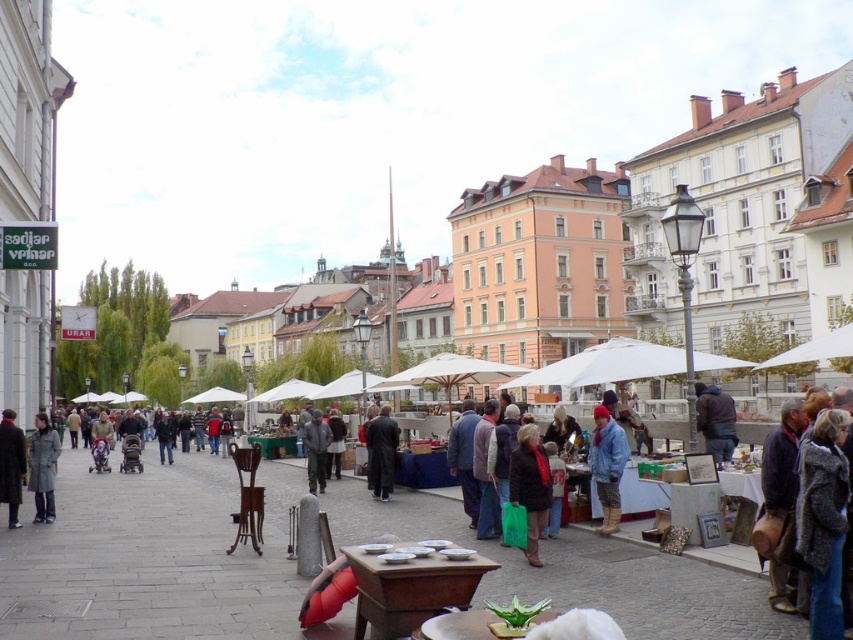
Question: Which point is farther to the camera?

Choices:
 (A) dark brown leather coat at center
 (B) denim jacket at center
 (C) gray wool coat at center

Answer: (A)

Question: Considering the real-world distances, which object is closest to the dark gray jacket at center?

Choices:
 (A) gray wool coat at center
 (B) dark gray coat at lower left

Answer: (A)

Question: Does gray wool coat at center appear under dark brown leather coat at center?

Choices:
 (A) yes
 (B) no

Answer: (B)

Question: In this image, where is dark gray coat at lower left located relative to dark gray jacket at center?

Choices:
 (A) above
 (B) below

Answer: (A)

Question: Based on their relative distances, which object is nearer to the brown leather jacket at center?

Choices:
 (A) dark brown leather coat at center
 (B) dark gray jacket at center

Answer: (A)

Question: Does brown leather jacket at center have a lesser width compared to dark gray coat at lower left?

Choices:
 (A) yes
 (B) no

Answer: (B)